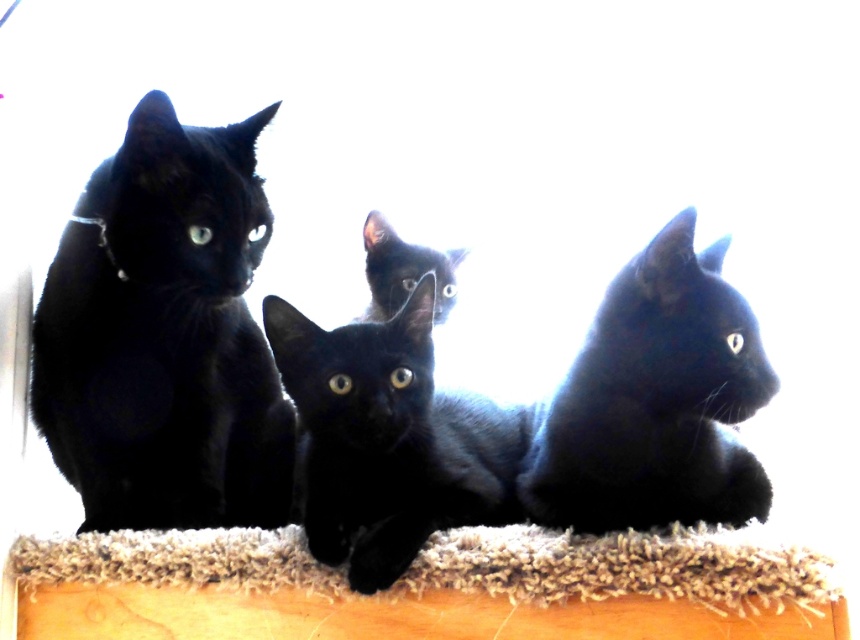
You are a photographer trying to capture a clear image of the matte black cat at left and the fuzzy carpet at lower center. Since the cats are alert, you need to know which one is taller to adjust your camera angle. Can you tell me which is taller?

The matte black cat at left is taller than the fuzzy carpet at lower center.

You are a photographer trying to capture the shiny black kitten at center. Your camera is set up at point 0.0, 0.0. Where should you aim your camera to get the kitten in the frame?

You should aim your camera at point (388,440) to capture the shiny black kitten at center.

You are standing at the origin point of the image. Which of the two points, point (306,426) or point (594,561), is closer to you?

Point (594,561) is closer to you because it is in front of point (306,426).